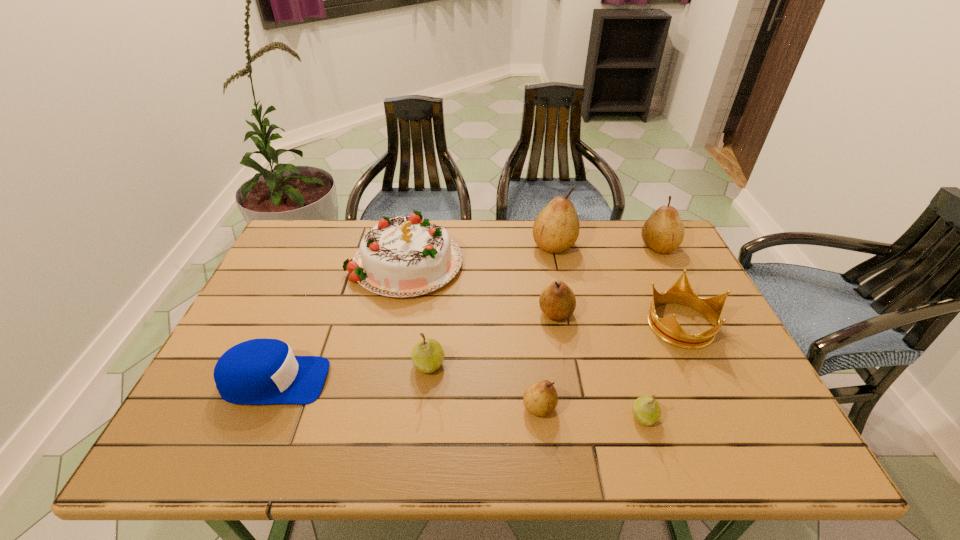
Identify the location of free space at the right edge of the desktop. pos(688,317).

This screenshot has width=960, height=540. I want to click on vacant space at the far left corner of the desktop, so click(x=320, y=235).

In the image, there is a desktop. At what (x,y) coordinates should I click in order to perform the action: click on free space at the far right corner. Please return your answer as a coordinate pair (x, y). The image size is (960, 540). Looking at the image, I should click on (665, 259).

In the image, there is a desktop. Where is `free region at the near right corner`? The width and height of the screenshot is (960, 540). free region at the near right corner is located at coordinates coord(755,428).

Find the location of a particular element. The width and height of the screenshot is (960, 540). vacant area that lies between the cake and the nearest brown pear is located at coordinates (472, 334).

Where is `unoccupied area between the third smallest brown pear and the crown`? unoccupied area between the third smallest brown pear and the crown is located at coordinates (670, 285).

Locate an element on the screen. The image size is (960, 540). free spot between the baseball cap and the nearest brown pear is located at coordinates (407, 394).

I want to click on empty location between the biggest brown pear and the cake, so click(x=480, y=252).

Identify the location of unoccupied area between the biggest brown pear and the cake. This screenshot has width=960, height=540. (480, 252).

Identify the location of free spot between the second biggest brown pear and the third object from right to left. This screenshot has height=540, width=960. (651, 332).